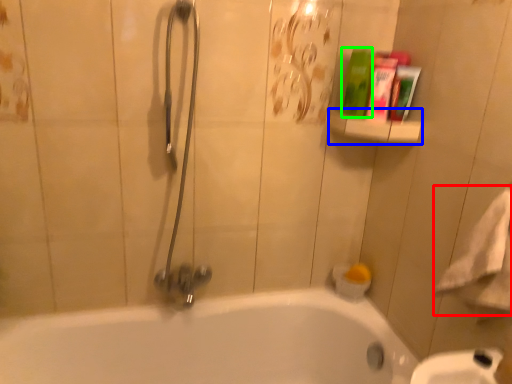
Question: Considering the real-world distances, which object is farthest from bath towel (highlighted by a red box)? balustrade (highlighted by a blue box) or cleaning product (highlighted by a green box)?

Choices:
 (A) balustrade
 (B) cleaning product

Answer: (B)